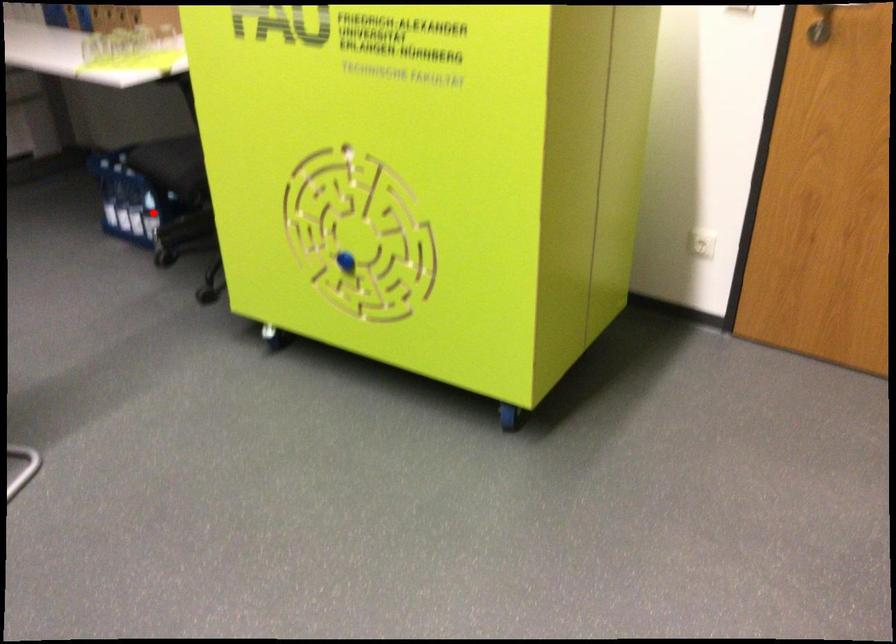
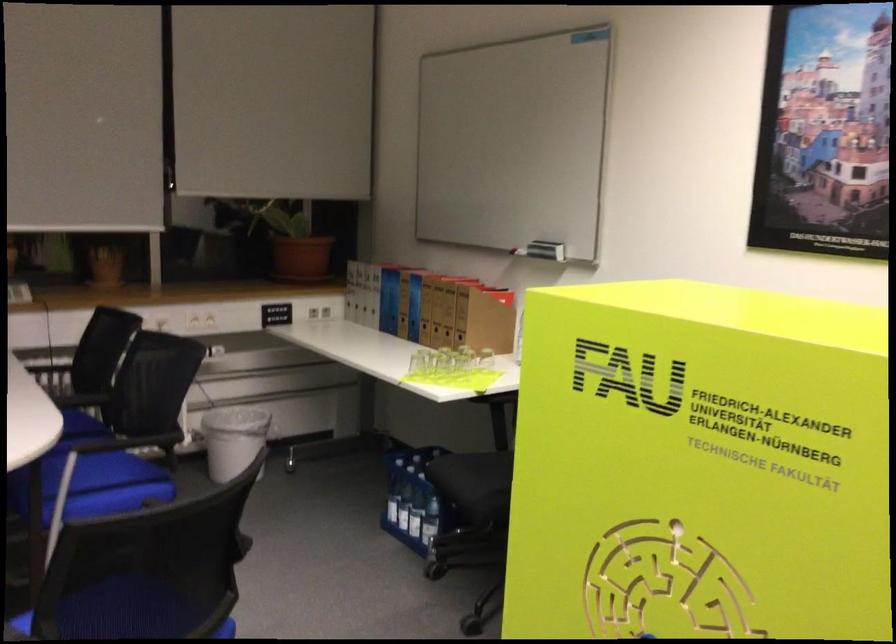
The point at the highlighted location is marked in the first image. Where is the corresponding point in the second image?

(429, 520)